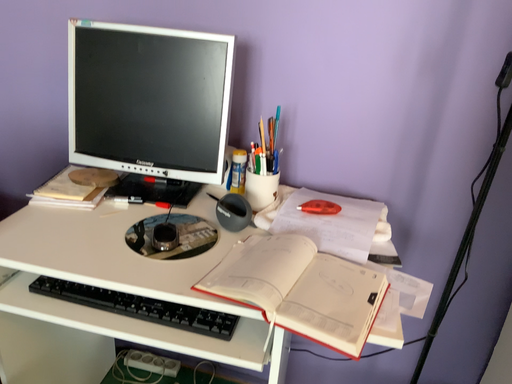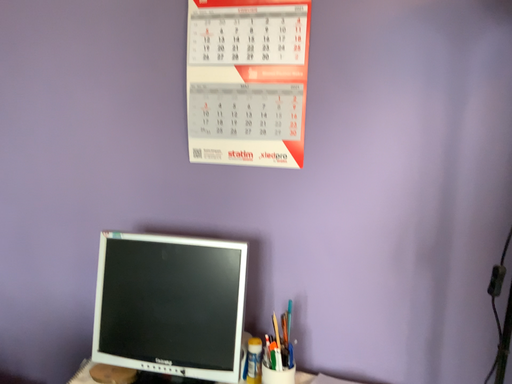
Question: Which way did the camera rotate in the video?

Choices:
 (A) rotated upward
 (B) rotated downward

Answer: (A)